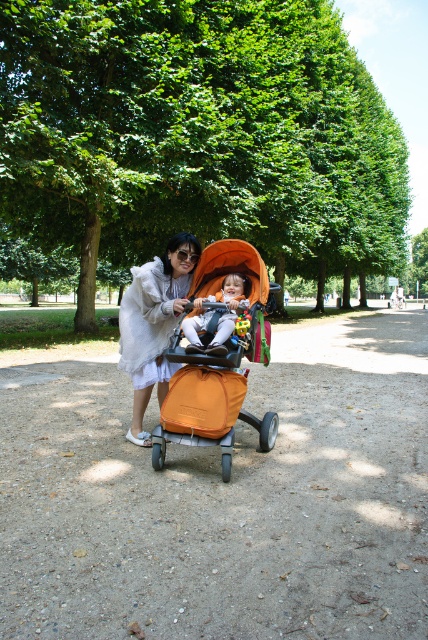
Based on the photo, you are a photographer standing in the park and want to take a photo of the orange fabric baby carriage at center and the soft orange stroller at center. Which one will appear larger in the photo?

The orange fabric baby carriage at center will appear larger in the photo because it is closer to the viewer than the soft orange stroller at center.

You are a photographer trying to capture a photo of the white fluffy coat at center and the soft orange stroller at center in the park scene. You want to ensure both items are fully visible in the frame. Based on their widths, which item requires more horizontal space in the photo composition?

The white fluffy coat at center requires more horizontal space in the photo composition because its width surpasses that of the soft orange stroller at center.